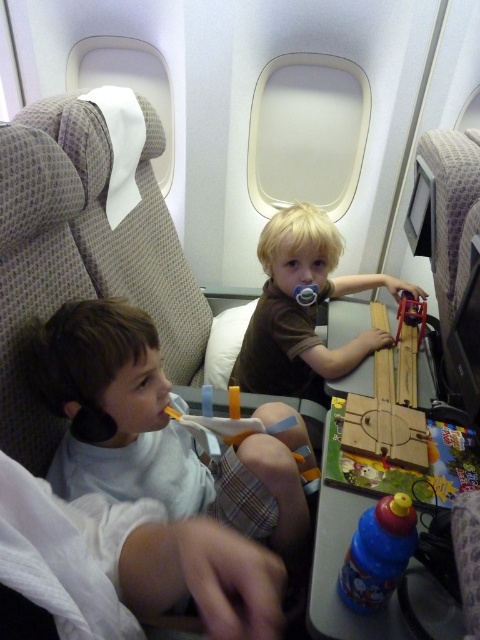
Question: In this image, where is brown matte shirt at center located relative to blue plastic water bottle at lower center?

Choices:
 (A) below
 (B) above

Answer: (B)

Question: Which point is closer to the camera taking this photo?

Choices:
 (A) (337, 248)
 (B) (364, 580)
 (C) (202, 493)
 (D) (298, 285)

Answer: (B)

Question: Which of the following is the closest to the observer?

Choices:
 (A) (362, 600)
 (B) (349, 292)
 (C) (236, 445)
 (D) (303, 292)

Answer: (A)

Question: Is brown matte shirt at center to the left of wooden train at center from the viewer's perspective?

Choices:
 (A) no
 (B) yes

Answer: (A)

Question: Which point is closer to the camera taking this photo?

Choices:
 (A) (279, 323)
 (B) (273, 404)
 (C) (299, 296)
 (D) (407, 528)

Answer: (D)

Question: Does white soft toothbrush at left appear over blue plastic water bottle at lower center?

Choices:
 (A) yes
 (B) no

Answer: (A)